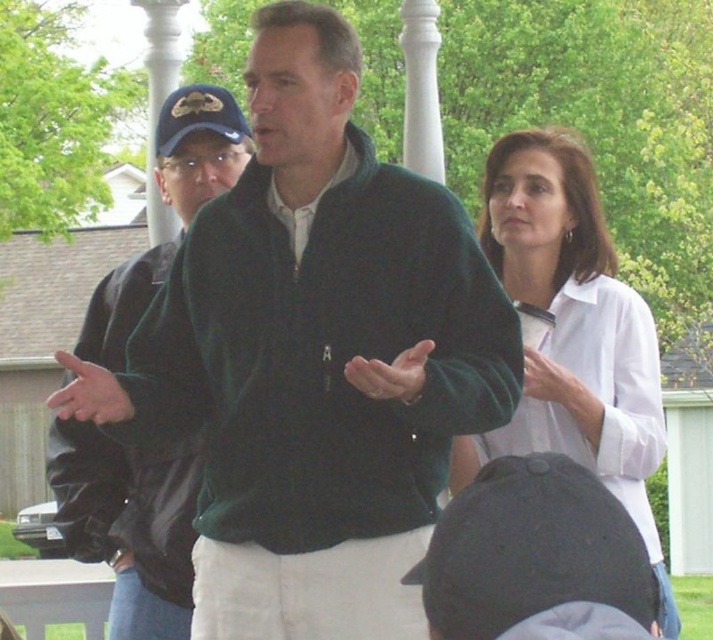
In the scene shown: You are a photographer trying to capture a clear shot of both the green fleece jacket at center and the green matte jacket at left. Since they are positioned close to each other, will you need to adjust your focus to ensure both are in focus?

The green fleece jacket at center is in front of the green matte jacket at left, so you will need to adjust your focus to ensure both are in focus since they are at different depths.

You are a photographer trying to capture a group photo of the green fleece jacket at center and the white smooth blouse at upper right. To ensure both are in frame, should you adjust your camera to focus more to the left or the right?

The green fleece jacket at center is positioned on the left side of white smooth blouse at upper right, so you should focus more to the right to include both in the frame.